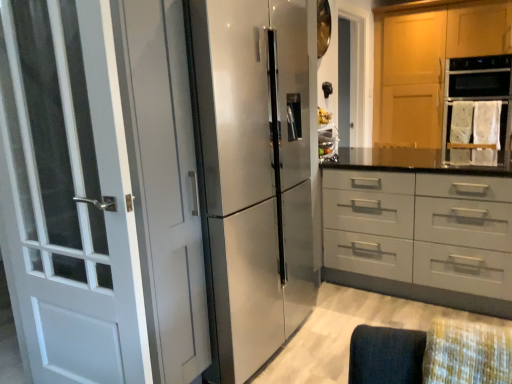
Question: Is matte gray drawer at center far away from wooden cabinet at upper right?

Choices:
 (A) yes
 (B) no

Answer: (A)

Question: Can you confirm if matte gray drawer at center is taller than wooden cabinet at upper right?

Choices:
 (A) yes
 (B) no

Answer: (B)

Question: Would you say wooden cabinet at upper right is part of matte gray drawer at center's contents?

Choices:
 (A) no
 (B) yes

Answer: (A)

Question: Considering the relative sizes of matte gray drawer at center and wooden cabinet at upper right in the image provided, is matte gray drawer at center wider than wooden cabinet at upper right?

Choices:
 (A) no
 (B) yes

Answer: (B)

Question: Does matte gray drawer at center have a lesser height compared to wooden cabinet at upper right?

Choices:
 (A) no
 (B) yes

Answer: (B)

Question: Is satin silver refrigerator at center to the left or to the right of matte gray drawer at center in the image?

Choices:
 (A) left
 (B) right

Answer: (A)

Question: Is point (274, 26) closer or farther from the camera than point (331, 200)?

Choices:
 (A) closer
 (B) farther

Answer: (A)

Question: Considering their positions, is satin silver refrigerator at center located in front of or behind matte gray drawer at center?

Choices:
 (A) behind
 (B) front

Answer: (B)

Question: In terms of height, does satin silver refrigerator at center look taller or shorter compared to matte gray drawer at center?

Choices:
 (A) short
 (B) tall

Answer: (B)

Question: From a real-world perspective, relative to white glossy door at left, is wooden cabinet at upper right vertically above or below?

Choices:
 (A) below
 (B) above

Answer: (B)

Question: Is wooden cabinet at upper right wider or thinner than white glossy door at left?

Choices:
 (A) wide
 (B) thin

Answer: (A)

Question: Do you think wooden cabinet at upper right is within white glossy door at left, or outside of it?

Choices:
 (A) inside
 (B) outside

Answer: (B)

Question: In terms of height, does wooden cabinet at upper right look taller or shorter compared to white glossy door at left?

Choices:
 (A) tall
 (B) short

Answer: (A)

Question: In the image, is wooden cabinet at upper right on the left side or the right side of matte gray drawer at center?

Choices:
 (A) left
 (B) right

Answer: (B)

Question: From the image's perspective, is wooden cabinet at upper right above or below matte gray drawer at center?

Choices:
 (A) below
 (B) above

Answer: (B)